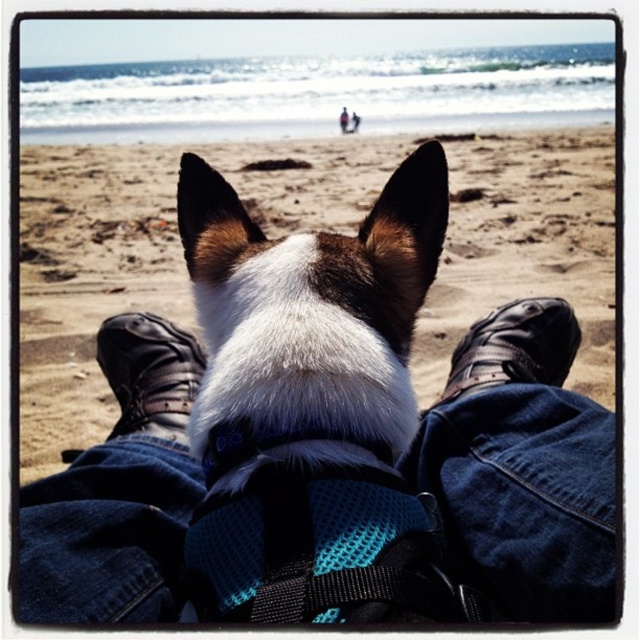
You are lying on the beach and see the white fur at center. Where exactly is the white fur located in relation to your position?

The white fur at center is located at point 0.609 on the horizontal axis and 0.478 on the vertical axis relative to your position.

You are lying on the beach and want to place a small seashell between the white fur at center and the leather boot at lower center. Which object should you place it closer to to ensure it stays visible? Explain your reasoning based on their heights.

The white fur at center is taller than the leather boot at lower center. To ensure the seashell stays visible, place it closer to the shorter leather boot at lower center so it won not be obscured by the taller white fur at center.